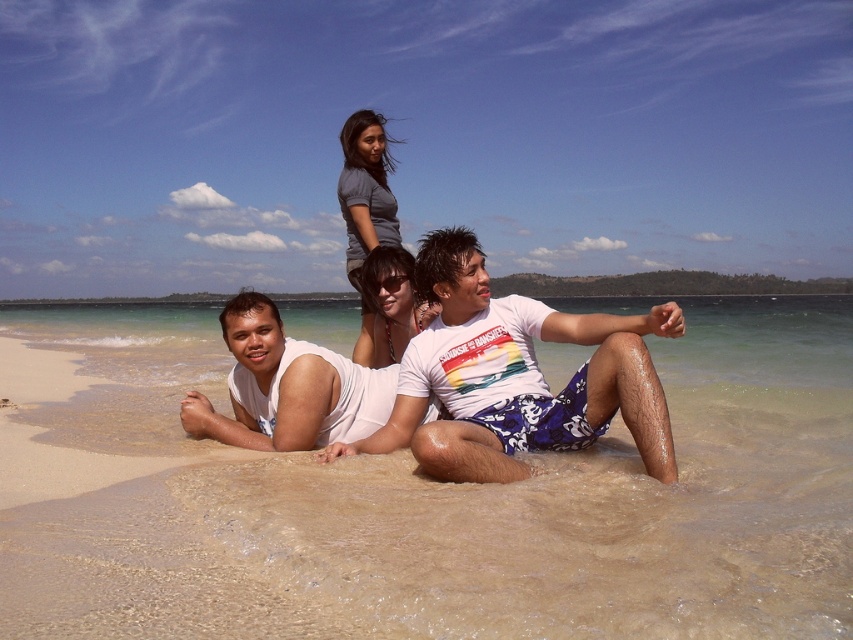
You are a photographer trying to capture the scene of the gray matte shirt at upper center and the matte white sunglasses at center. Which object should you focus on first if you want to start from the top of the image and work your way down?

The gray matte shirt at upper center is above the matte white sunglasses at center, so you should focus on the gray matte shirt at upper center first.